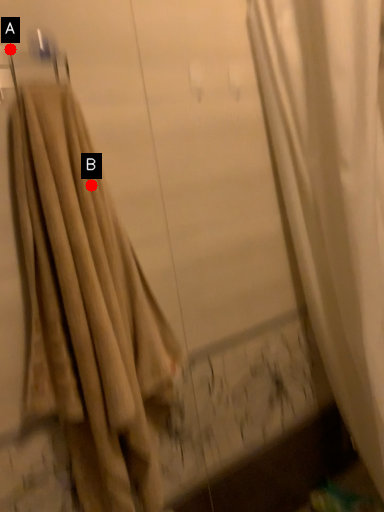
Question: Two points are circled on the image, labeled by A and B beside each circle. Which point is further to the camera?

Choices:
 (A) A is further
 (B) B is further

Answer: (B)